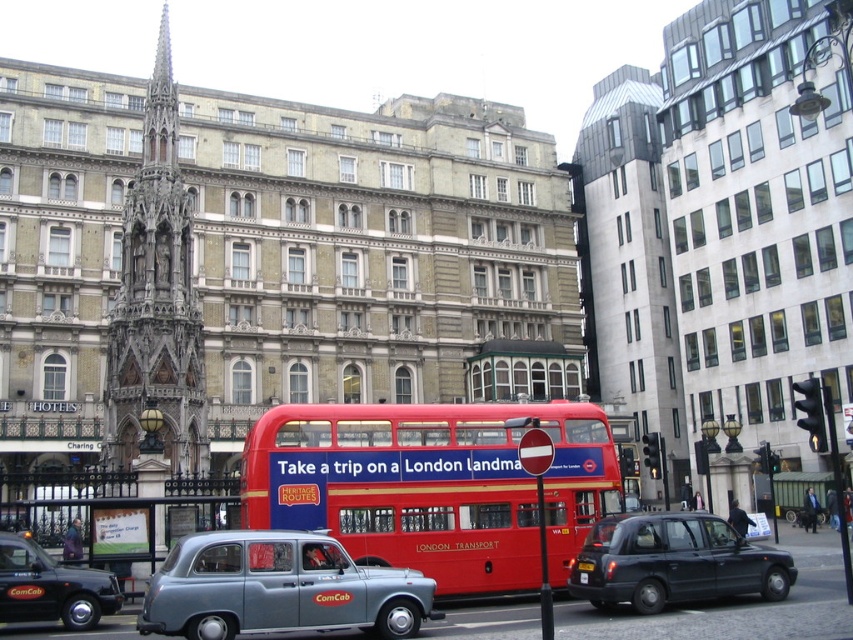
You are a pedestrian standing at the intersection near the black rubber taxi at lower right and the black plastic license plate at center. You need to cross the street to reach the red double decker bus in the center. Considering the distance between the two objects, will you be able to safely cross the road within a single crossing phase if the traffic light allows for a 10 feet crossing distance?

The black rubber taxi at lower right is 9.78 feet from the black plastic license plate at center. Since the traffic light allows for a 10 feet crossing distance, you can safely cross the road within a single crossing phase.

You are a tourist in London and want to take a photo of the metallic gray taxi at center without the black plastic license plate at center appearing in the shot. How can you adjust your position to achieve this?

Move forward closer to the metallic gray taxi at center so that the black plastic license plate at center is no longer in the frame behind it.